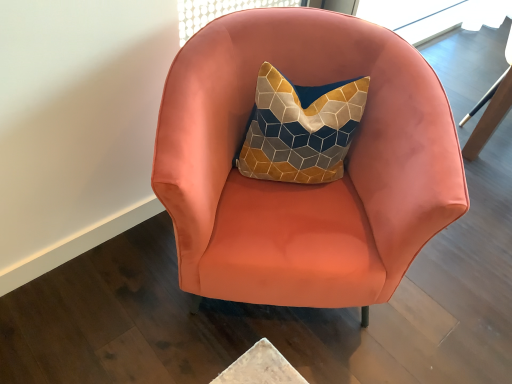
Question: Does satin coral armchair at center have a smaller size compared to matte coral swivel chair at right?

Choices:
 (A) yes
 (B) no

Answer: (B)

Question: Is satin coral armchair at center looking in the opposite direction of matte coral swivel chair at right?

Choices:
 (A) no
 (B) yes

Answer: (A)

Question: Does satin coral armchair at center have a greater width compared to matte coral swivel chair at right?

Choices:
 (A) yes
 (B) no

Answer: (A)

Question: Would you say satin coral armchair at center is outside matte coral swivel chair at right?

Choices:
 (A) no
 (B) yes

Answer: (B)

Question: Is satin coral armchair at center shorter than matte coral swivel chair at right?

Choices:
 (A) no
 (B) yes

Answer: (A)

Question: Can you confirm if satin coral armchair at center is bigger than matte coral swivel chair at right?

Choices:
 (A) no
 (B) yes

Answer: (B)

Question: Is matte coral swivel chair at right oriented towards satin coral armchair at center?

Choices:
 (A) no
 (B) yes

Answer: (A)

Question: Is matte coral swivel chair at right facing away from satin coral armchair at center?

Choices:
 (A) no
 (B) yes

Answer: (A)

Question: From the image's perspective, would you say matte coral swivel chair at right is shown under satin coral armchair at center?

Choices:
 (A) yes
 (B) no

Answer: (B)

Question: From the image's perspective, is matte coral swivel chair at right on top of satin coral armchair at center?

Choices:
 (A) no
 (B) yes

Answer: (B)

Question: Does matte coral swivel chair at right appear on the right side of satin coral armchair at center?

Choices:
 (A) no
 (B) yes

Answer: (B)

Question: Is matte coral swivel chair at right completely or partially outside of satin coral armchair at center?

Choices:
 (A) yes
 (B) no

Answer: (A)

Question: In terms of height, does satin coral armchair at center look taller or shorter compared to matte coral swivel chair at right?

Choices:
 (A) tall
 (B) short

Answer: (A)